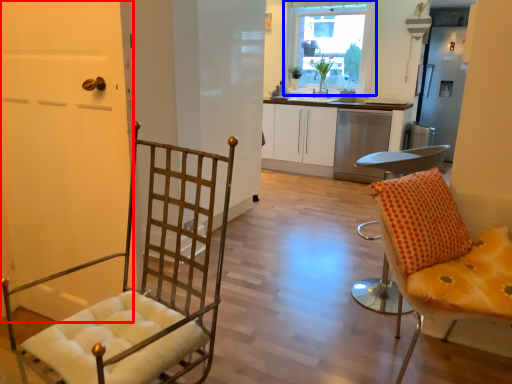
Question: Which object is further to the camera taking this photo, door (highlighted by a red box) or window (highlighted by a blue box)?

Choices:
 (A) door
 (B) window

Answer: (B)